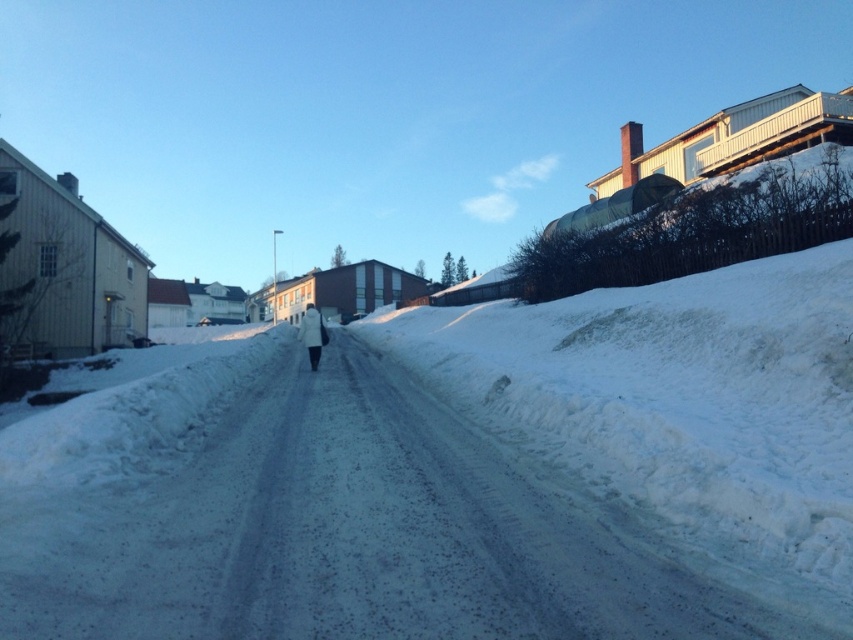
Between point (572, 436) and point (300, 326), which one is positioned behind?

The point (300, 326) is behind.

Is white fluffy snow at center above white fluffy coat at center?

Actually, white fluffy snow at center is below white fluffy coat at center.

Does point (665, 449) come farther from viewer compared to point (323, 344)?

No, it is not.

This screenshot has width=853, height=640. Identify the location of white fluffy snow at center. (457, 474).